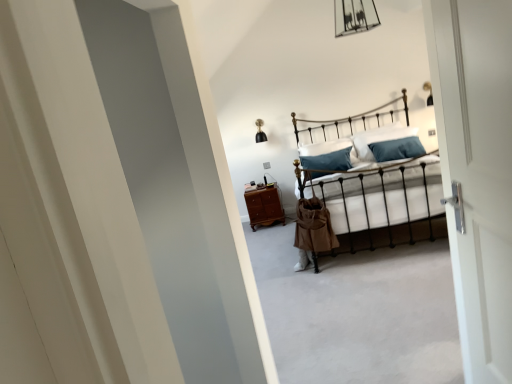
Question: Which direction should I rotate to look at white soft pillow at center, acting as the 2th pillow starting from the left?

Choices:
 (A) right
 (B) left

Answer: (A)

Question: Is metallic iron bed at center looking in the opposite direction of brown wooden nightstand at center?

Choices:
 (A) no
 (B) yes

Answer: (A)

Question: Is metallic iron bed at center facing towards brown wooden nightstand at center?

Choices:
 (A) yes
 (B) no

Answer: (B)

Question: Would you say metallic iron bed at center is outside brown wooden nightstand at center?

Choices:
 (A) no
 (B) yes

Answer: (B)

Question: Does metallic iron bed at center have a greater height compared to brown wooden nightstand at center?

Choices:
 (A) no
 (B) yes

Answer: (B)

Question: Does metallic iron bed at center have a larger size compared to brown wooden nightstand at center?

Choices:
 (A) yes
 (B) no

Answer: (A)

Question: From the image's perspective, is metallic iron bed at center above brown wooden nightstand at center?

Choices:
 (A) yes
 (B) no

Answer: (A)

Question: From the image's perspective, is white soft pillow at center, acting as the 2th pillow starting from the left, located beneath brown wooden nightstand at center?

Choices:
 (A) no
 (B) yes

Answer: (A)

Question: Is white soft pillow at center, acting as the 2th pillow starting from the left, further to camera compared to brown wooden nightstand at center?

Choices:
 (A) yes
 (B) no

Answer: (B)

Question: Is white soft pillow at center, acting as the 2th pillow starting from the left, facing towards brown wooden nightstand at center?

Choices:
 (A) yes
 (B) no

Answer: (B)

Question: Considering the relative sizes of white soft pillow at center, acting as the 2th pillow starting from the left, and brown wooden nightstand at center in the image provided, is white soft pillow at center, acting as the 2th pillow starting from the left, taller than brown wooden nightstand at center?

Choices:
 (A) no
 (B) yes

Answer: (B)

Question: Is brown wooden nightstand at center inside white soft pillow at center, the 1th pillow viewed from the right?

Choices:
 (A) no
 (B) yes

Answer: (A)

Question: Is white soft pillow at center, acting as the 2th pillow starting from the left, in front of brown wooden nightstand at center?

Choices:
 (A) yes
 (B) no

Answer: (A)

Question: Would you say metallic iron bed at center is outside white soft pillow at center, which is the 1th pillow in left-to-right order?

Choices:
 (A) yes
 (B) no

Answer: (A)